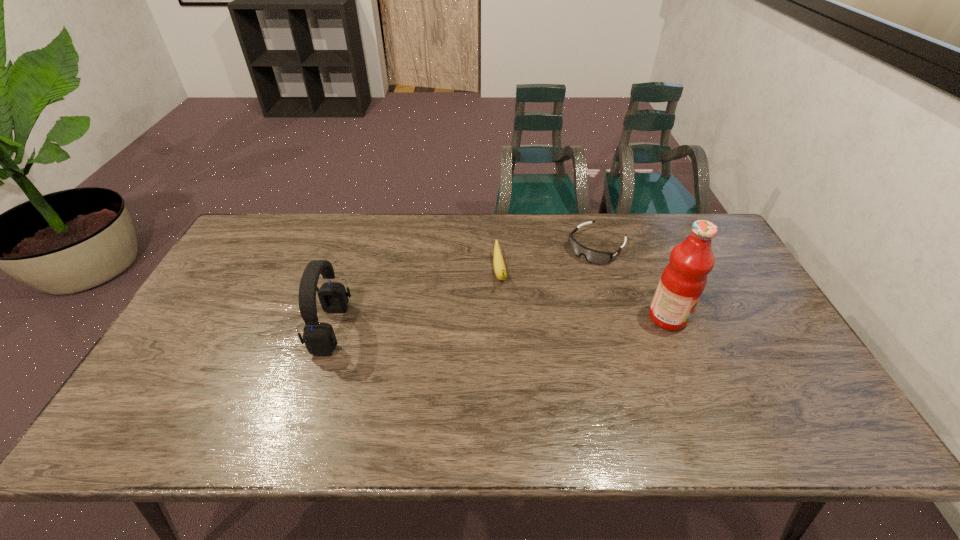
At what (x,y) coordinates should I click in order to perform the action: click on free spot on the desktop that is between the leftmost object and the fruit juice and is positioned on the front and sides of the goggles. Please return your answer as a coordinate pair (x, y). Looking at the image, I should click on (516, 322).

Where is `vacant space on the desktop that is between the third shortest object and the tallest object and is positioned at the stem of the second shortest object`? This screenshot has height=540, width=960. vacant space on the desktop that is between the third shortest object and the tallest object and is positioned at the stem of the second shortest object is located at coordinates (509, 323).